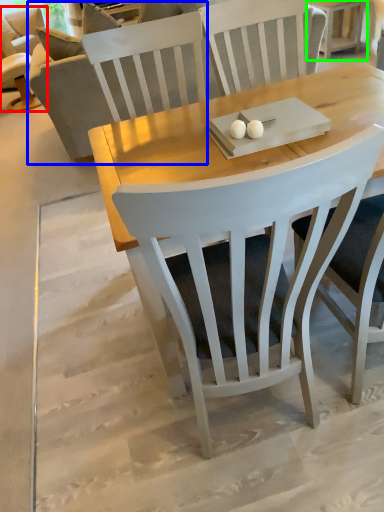
Question: Which is farther away from chair (highlighted by a red box)? couch (highlighted by a blue box) or side table (highlighted by a green box)?

Choices:
 (A) couch
 (B) side table

Answer: (B)